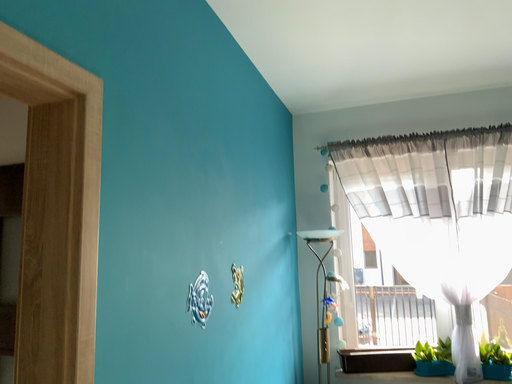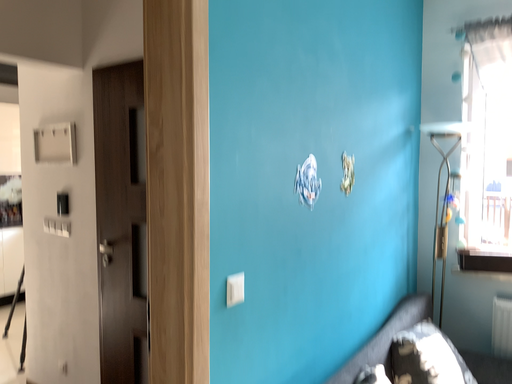
Question: How did the camera likely rotate when shooting the video?

Choices:
 (A) rotated downward
 (B) rotated upward

Answer: (A)